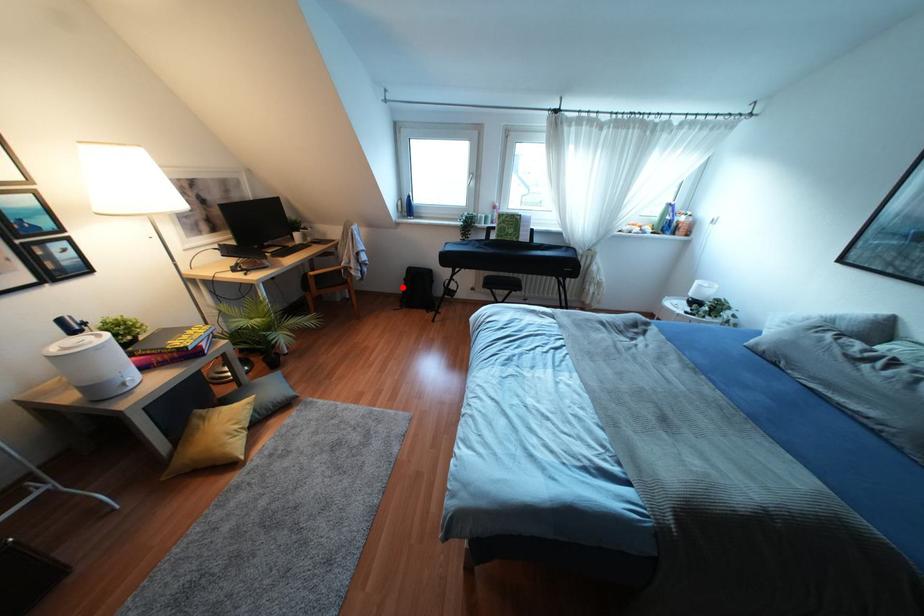
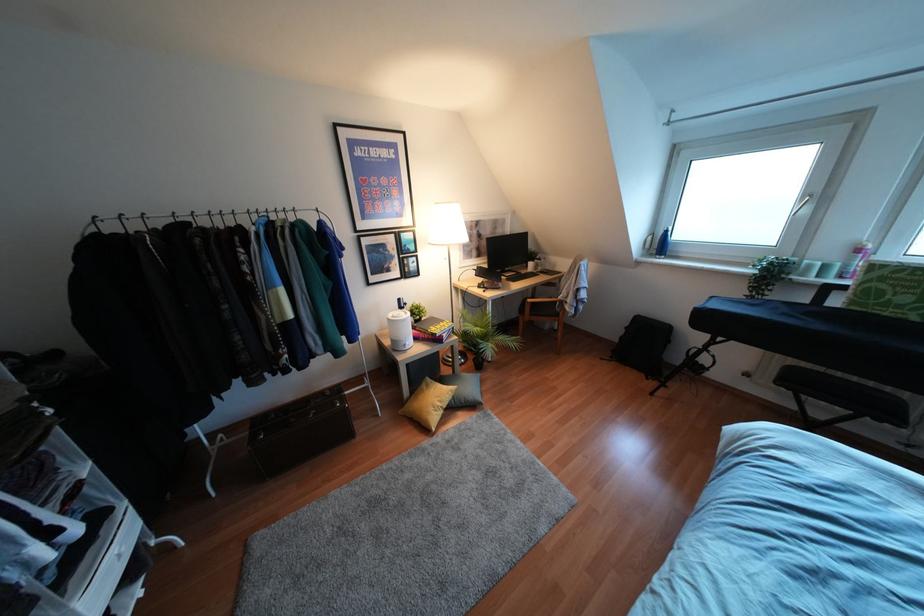
Question: I am providing you with two images of the same scene from different viewpoints. Given a red point in image1, look at the same physical point in image2. Is it:

Choices:
 (A) Closer to the viewpoint
 (B) Farther from the viewpoint

Answer: (A)